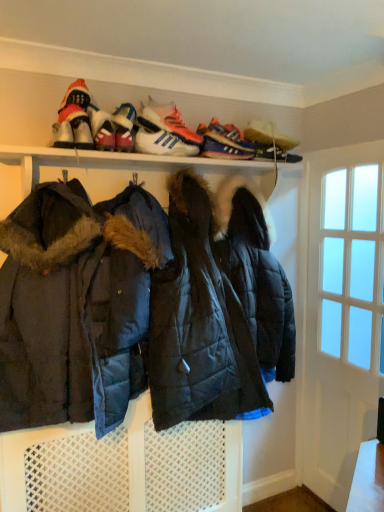
Question: From a real-world perspective, is purple suede sneaker at upper center, the 1th shoe positioned from the back, below white leather sneakers at upper center, the 3th footwear in the left-to-right sequence?

Choices:
 (A) no
 (B) yes

Answer: (B)

Question: Does purple suede sneaker at upper center, which ranks as the 2th shoe in front-to-back order, appear on the left side of white leather sneakers at upper center, the third footwear positioned from the right?

Choices:
 (A) yes
 (B) no

Answer: (B)

Question: Does purple suede sneaker at upper center, arranged as the 1th shoe when viewed from the right, come in front of white leather sneakers at upper center, the third footwear positioned from the right?

Choices:
 (A) no
 (B) yes

Answer: (A)

Question: Is white leather sneakers at upper center, the 3th footwear in the left-to-right sequence, inside purple suede sneaker at upper center, which ranks as the 2th shoe in front-to-back order?

Choices:
 (A) yes
 (B) no

Answer: (B)

Question: Can you confirm if purple suede sneaker at upper center, which ranks as the 2th shoe in front-to-back order, is taller than white leather sneakers at upper center, the third footwear positioned from the right?

Choices:
 (A) no
 (B) yes

Answer: (A)

Question: Is shiny black shoe at upper right, the fifth footwear when ordered from left to right, in front of or behind white leather sneakers at upper center, which ranks as the fourth footwear in left-to-right order, in the image?

Choices:
 (A) front
 (B) behind

Answer: (B)

Question: From a real-world perspective, is shiny black shoe at upper right, the fifth footwear when ordered from left to right, above or below white leather sneakers at upper center, acting as the second footwear starting from the right?

Choices:
 (A) below
 (B) above

Answer: (A)

Question: Looking at the image, does shiny black shoe at upper right, the fifth footwear when ordered from left to right, seem bigger or smaller compared to white leather sneakers at upper center, acting as the second footwear starting from the right?

Choices:
 (A) big
 (B) small

Answer: (B)

Question: Would you say shiny black shoe at upper right, the fifth footwear when ordered from left to right, is to the left or to the right of white leather sneakers at upper center, which ranks as the fourth footwear in left-to-right order, in the picture?

Choices:
 (A) left
 (B) right

Answer: (B)

Question: Based on their sizes in the image, would you say dark blue quilted jacket at center is bigger or smaller than white leather sneakers at upper center, acting as the second footwear starting from the right?

Choices:
 (A) small
 (B) big

Answer: (B)

Question: From the image's perspective, relative to white leather sneakers at upper center, acting as the second footwear starting from the right, is dark blue quilted jacket at center above or below?

Choices:
 (A) below
 (B) above

Answer: (A)

Question: From a real-world perspective, is dark blue quilted jacket at center above or below white leather sneakers at upper center, acting as the second footwear starting from the right?

Choices:
 (A) below
 (B) above

Answer: (A)

Question: In the image, is dark blue quilted jacket at center positioned in front of or behind white leather sneakers at upper center, which ranks as the fourth footwear in left-to-right order?

Choices:
 (A) front
 (B) behind

Answer: (A)

Question: Is point (370, 338) positioned closer to the camera than point (125, 111)?

Choices:
 (A) closer
 (B) farther

Answer: (B)

Question: From a real-world perspective, is white glass door at right above or below shiny pink sneaker at upper center, which is the 4th footwear from right to left?

Choices:
 (A) below
 (B) above

Answer: (A)